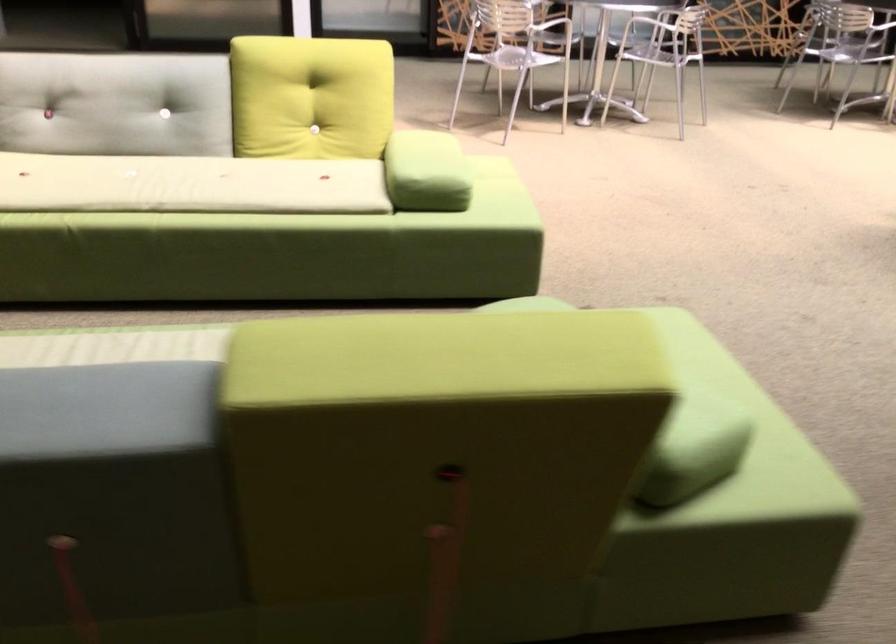
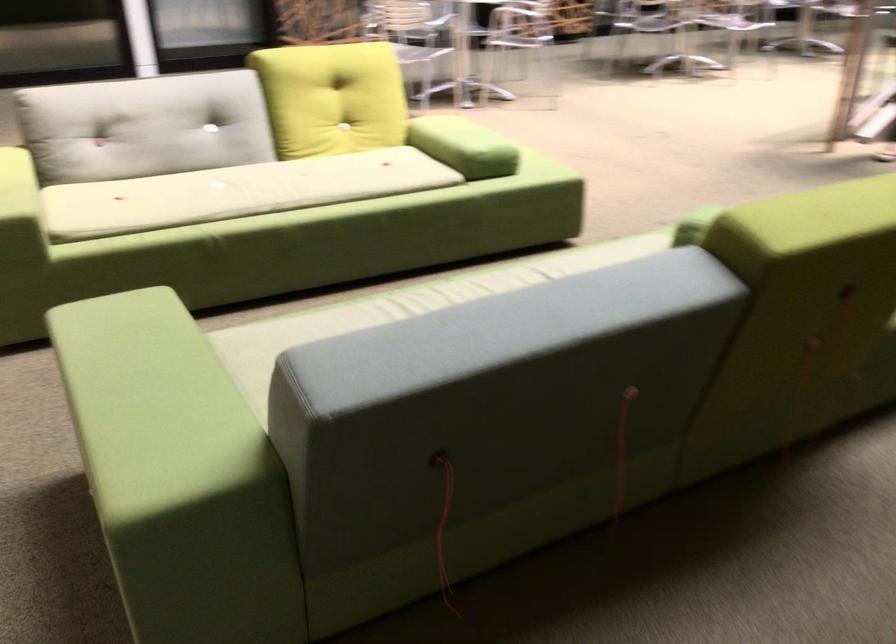
In the second image, find the point that corresponds to (x=126, y=181) in the first image.

(236, 192)